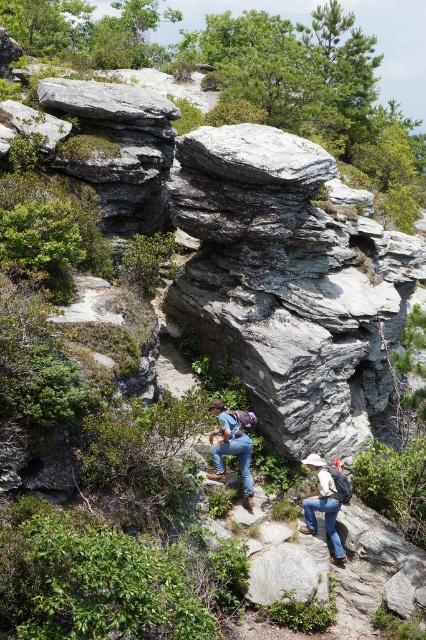
Question: Based on their relative distances, which object is farther from the gray rock at upper center?

Choices:
 (A) gray rough rock at center
 (B) blue jeans at center
 (C) gray rough rock at upper center
 (D) denim jeans at center

Answer: (A)

Question: Does blue jeans at center have a smaller size compared to denim jeans at center?

Choices:
 (A) yes
 (B) no

Answer: (B)

Question: Which point is closer to the camera?

Choices:
 (A) denim jeans at center
 (B) gray rough rock at center

Answer: (B)

Question: Which object is the closest to the denim jeans at center?

Choices:
 (A) gray rock at upper center
 (B) blue jeans at center
 (C) gray rough rock at center
 (D) gray rough rock at upper center

Answer: (C)

Question: Can you confirm if gray rough rock at upper center is wider than denim jeans at center?

Choices:
 (A) no
 (B) yes

Answer: (B)

Question: Is gray rock at upper center closer to camera compared to gray rough rock at center?

Choices:
 (A) yes
 (B) no

Answer: (B)